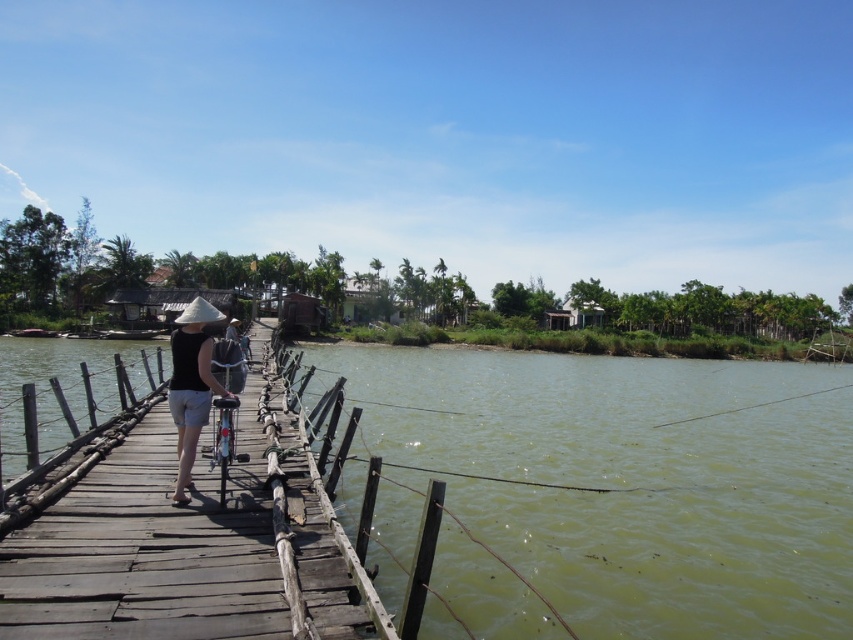
The image size is (853, 640). What do you see at coordinates (625, 477) in the screenshot?
I see `green murky water at center` at bounding box center [625, 477].

Does green murky water at center have a larger size compared to matte black shirt at center?

Correct, green murky water at center is larger in size than matte black shirt at center.

At what (x,y) coordinates should I click in order to perform the action: click on green murky water at center. Please return your answer as a coordinate pair (x, y). The width and height of the screenshot is (853, 640). Looking at the image, I should click on (625, 477).

Where is `green murky water at center`? green murky water at center is located at coordinates (625, 477).

Can you confirm if green murky water at center is wider than wooden dock at center?

Yes, green murky water at center is wider than wooden dock at center.

Can you confirm if green murky water at center is smaller than wooden dock at center?

Actually, green murky water at center might be larger than wooden dock at center.

Between point (846, 632) and point (55, 460), which one is positioned behind?

Point (55, 460)

I want to click on green murky water at center, so click(x=625, y=477).

Is point (54, 620) closer to viewer compared to point (189, 477)?

Yes, point (54, 620) is closer to viewer.

Locate an element on the screen. wooden dock at center is located at coordinates (190, 541).

Identify the location of wooden dock at center. Image resolution: width=853 pixels, height=640 pixels. (190, 541).